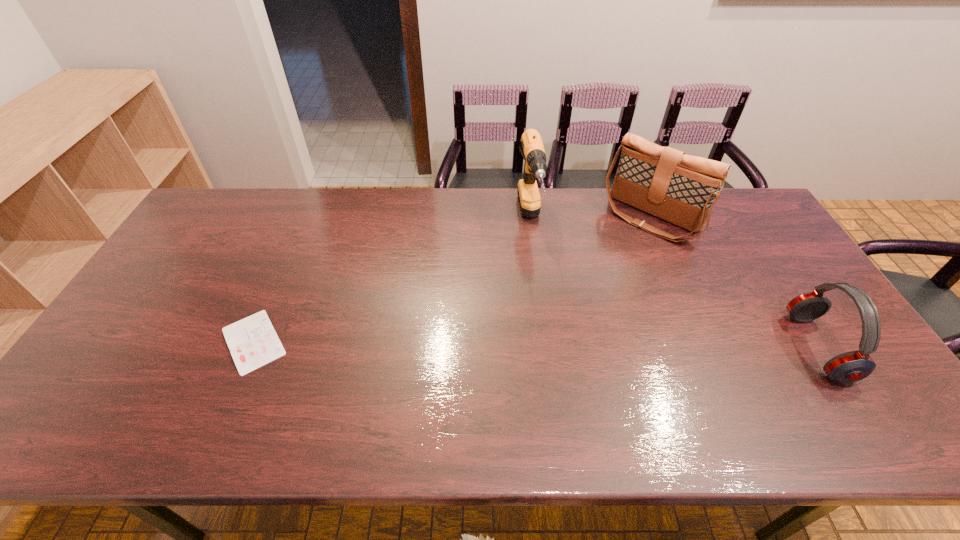
The height and width of the screenshot is (540, 960). I want to click on free spot at the near edge of the desktop, so click(585, 378).

Find the location of `vacant area that lies between the second object from left to right and the diary`. vacant area that lies between the second object from left to right and the diary is located at coordinates (392, 281).

The image size is (960, 540). Identify the location of vacant space that is in between the diary and the third object from left to right. (452, 279).

This screenshot has width=960, height=540. I want to click on unoccupied position between the third object from left to right and the rightmost object, so tap(733, 282).

The image size is (960, 540). Find the location of `vacant point located between the drill and the earphone`. vacant point located between the drill and the earphone is located at coordinates (673, 284).

Locate an element on the screen. The image size is (960, 540). free area in between the earphone and the shoulder bag is located at coordinates (733, 282).

I want to click on free space that is in between the third object from left to right and the second shortest object, so click(x=733, y=282).

Identify the location of empty space that is in between the second object from right to left and the third object from right to left. (590, 219).

Identify the location of free space between the diary and the rightmost object. The image size is (960, 540). (535, 344).

Where is `empty space between the shortest object and the drill`? The width and height of the screenshot is (960, 540). empty space between the shortest object and the drill is located at coordinates (392, 281).